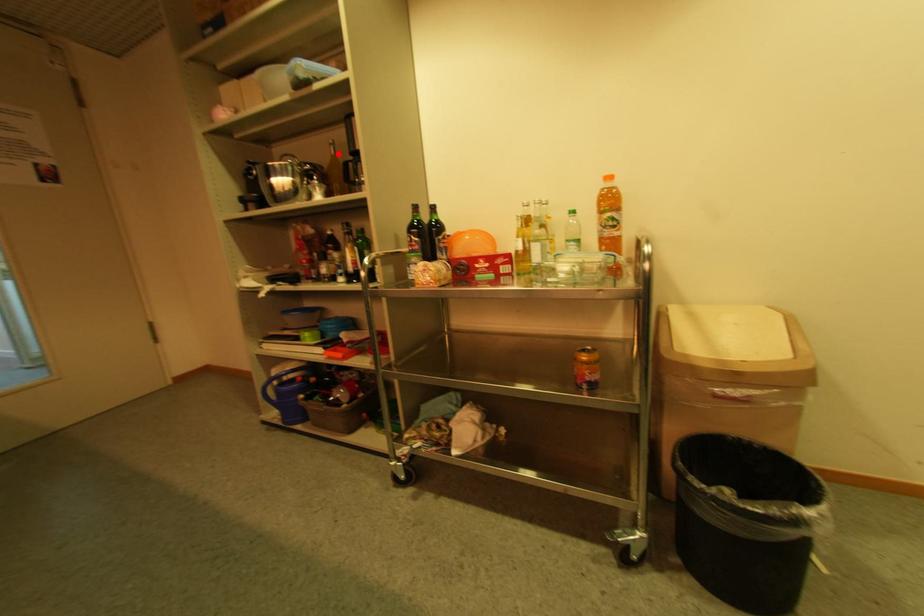
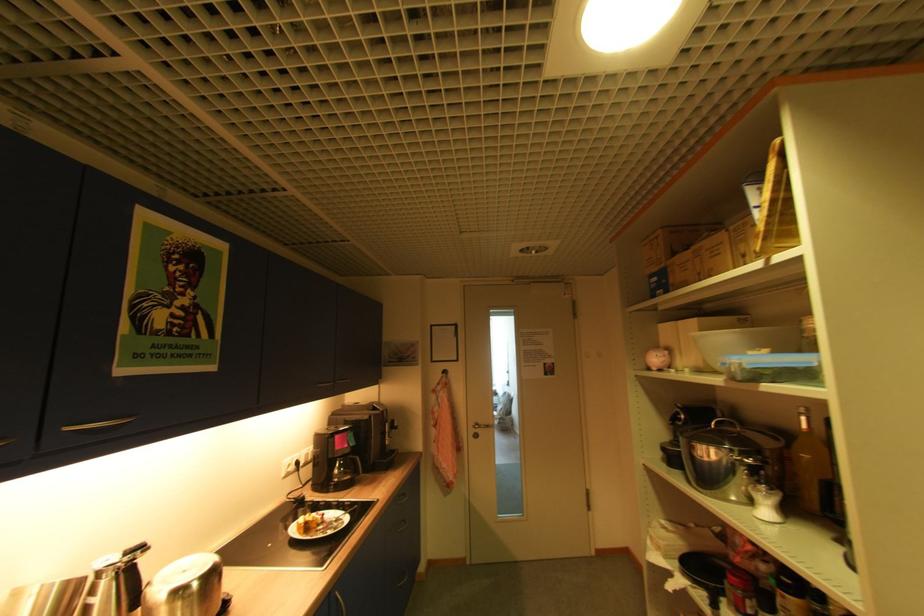
The point at the highlighted location is marked in the first image. Where is the corresponding point in the second image?

(809, 428)